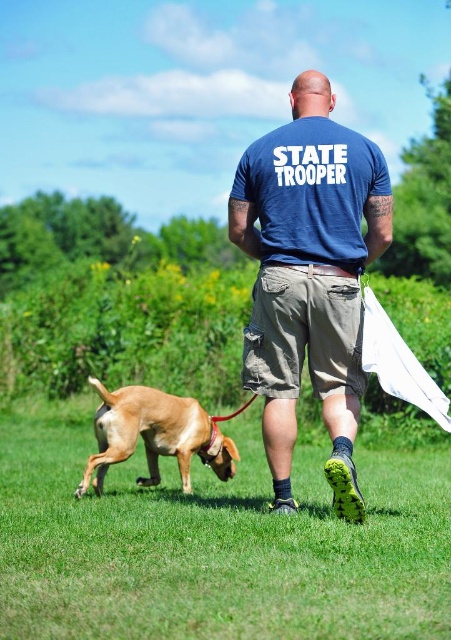
Question: Is green grass at lower center to the left of khaki cotton shorts at center from the viewer's perspective?

Choices:
 (A) no
 (B) yes

Answer: (B)

Question: Which of the following is the closest to the observer?

Choices:
 (A) (413, 509)
 (B) (345, 515)
 (C) (359, 372)
 (D) (161, 440)

Answer: (B)

Question: Which is farther from the blue cotton shirt at center?

Choices:
 (A) khaki cotton shorts at center
 (B) golden brown fur at lower left
 (C) green grass at lower center

Answer: (C)

Question: Is khaki cotton shorts at center bigger than golden brown fur at lower left?

Choices:
 (A) no
 (B) yes

Answer: (A)

Question: Estimate the real-world distances between objects in this image. Which object is closer to the green grass at lower center?

Choices:
 (A) blue cotton shirt at center
 (B) golden brown fur at lower left

Answer: (B)

Question: Can you confirm if green grass at lower center is positioned to the right of golden brown fur at lower left?

Choices:
 (A) no
 (B) yes

Answer: (B)